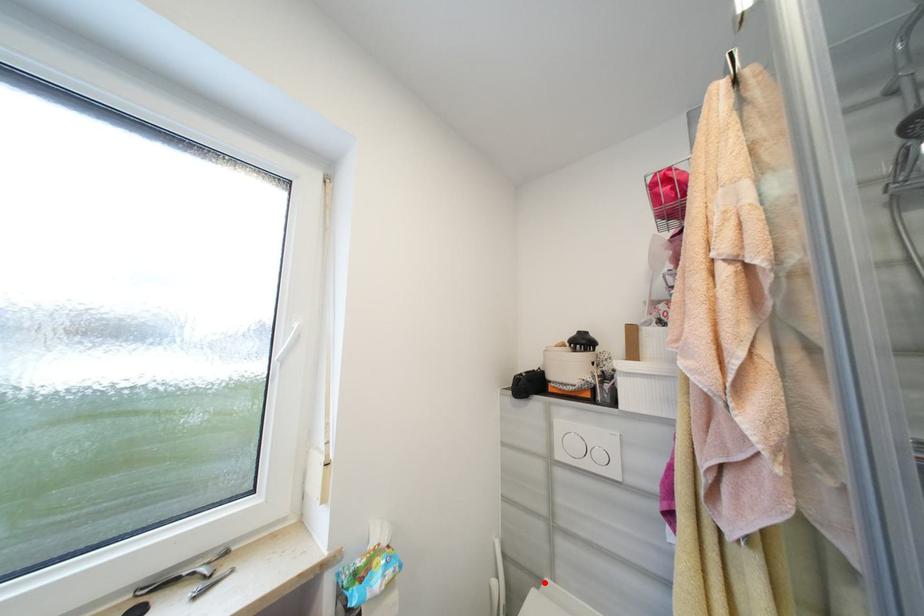
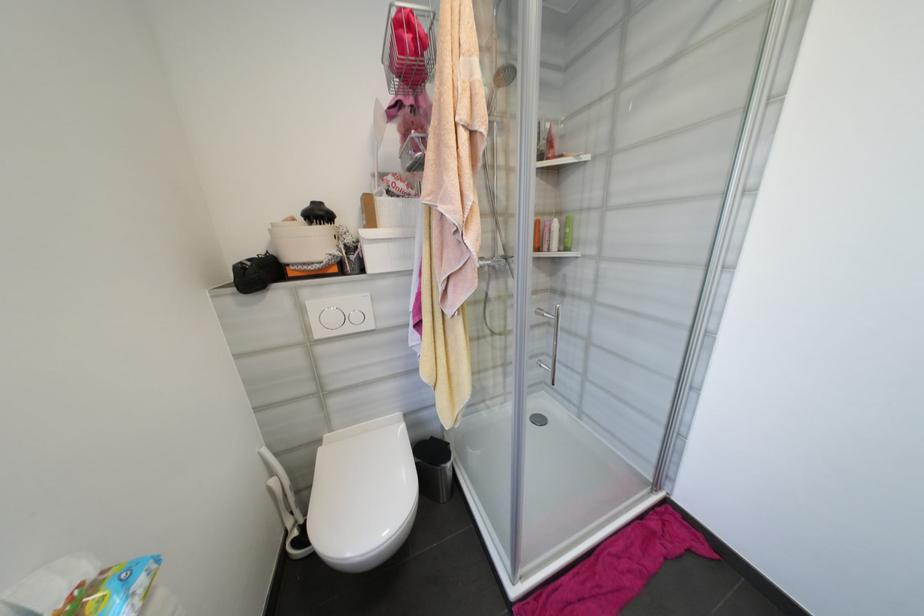
The point at the highlighted location is marked in the first image. Where is the corresponding point in the second image?

(325, 443)